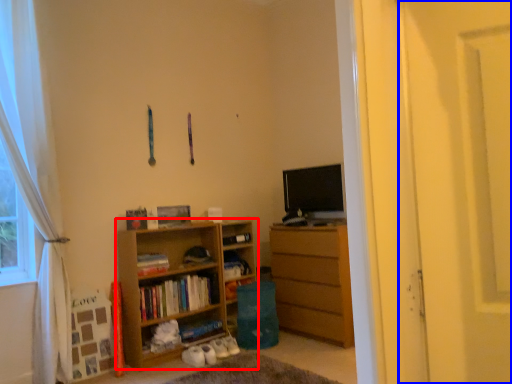
Question: Among these objects, which one is nearest to the camera, cupboard (highlighted by a red box) or screen door (highlighted by a blue box)?

Choices:
 (A) cupboard
 (B) screen door

Answer: (B)